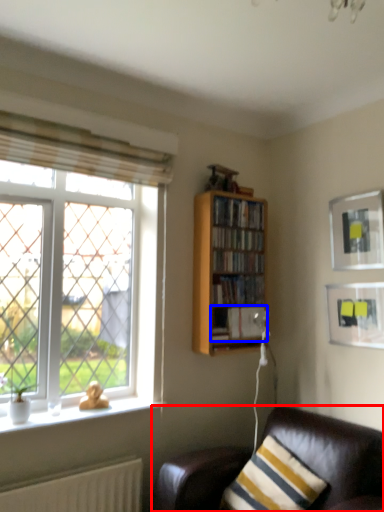
Question: Which object is closer to the camera taking this photo, studio couch (highlighted by a red box) or book (highlighted by a blue box)?

Choices:
 (A) studio couch
 (B) book

Answer: (A)